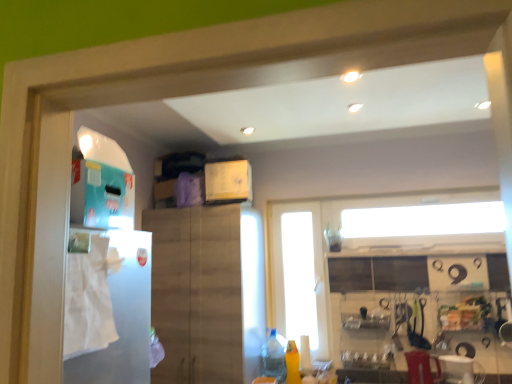
Question: Does clear plastic bottle at lower center, the first bottle viewed from the left, appear on the left side of white paper towel at left?

Choices:
 (A) no
 (B) yes

Answer: (A)

Question: Is clear plastic bottle at lower center, the first bottle viewed from the left, positioned far away from white paper towel at left?

Choices:
 (A) no
 (B) yes

Answer: (B)

Question: Is clear plastic bottle at lower center, positioned as the 2th bottle in right-to-left order, looking in the opposite direction of white paper towel at left?

Choices:
 (A) no
 (B) yes

Answer: (A)

Question: Does clear plastic bottle at lower center, positioned as the 2th bottle in right-to-left order, come behind white paper towel at left?

Choices:
 (A) yes
 (B) no

Answer: (A)

Question: Is clear plastic bottle at lower center, the first bottle viewed from the left, aimed at white paper towel at left?

Choices:
 (A) yes
 (B) no

Answer: (A)

Question: Does point (67, 367) appear closer or farther from the camera than point (300, 319)?

Choices:
 (A) closer
 (B) farther

Answer: (A)

Question: Relative to transparent glass door at center, is white paper towel at left in front or behind?

Choices:
 (A) behind
 (B) front

Answer: (B)

Question: From their relative heights in the image, would you say white paper towel at left is taller or shorter than transparent glass door at center?

Choices:
 (A) short
 (B) tall

Answer: (A)

Question: Based on their positions, is white paper towel at left located to the left or right of transparent glass door at center?

Choices:
 (A) left
 (B) right

Answer: (A)

Question: In the image, is wooden cabinet at center on the left side or the right side of white plastic blender at lower right?

Choices:
 (A) right
 (B) left

Answer: (B)

Question: Is wooden cabinet at center situated inside white plastic blender at lower right or outside?

Choices:
 (A) inside
 (B) outside

Answer: (B)

Question: From a real-world perspective, is wooden cabinet at center above or below white plastic blender at lower right?

Choices:
 (A) below
 (B) above

Answer: (B)

Question: Relative to white plastic blender at lower right, is wooden cabinet at center in front or behind?

Choices:
 (A) behind
 (B) front

Answer: (A)

Question: Is point (292, 291) closer or farther from the camera than point (270, 374)?

Choices:
 (A) closer
 (B) farther

Answer: (B)

Question: In the image, is transparent glass door at center on the left side or the right side of clear plastic bottle at lower center, positioned as the 2th bottle in right-to-left order?

Choices:
 (A) left
 (B) right

Answer: (B)